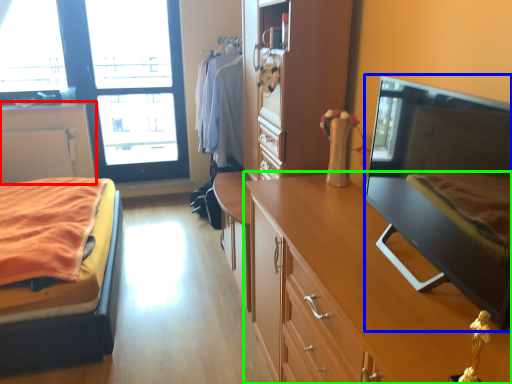
Question: Which object is the farthest from cabinetry (highlighted by a red box)? Choose among these: flat (highlighted by a blue box) or cabinetry (highlighted by a green box).

Choices:
 (A) flat
 (B) cabinetry

Answer: (A)